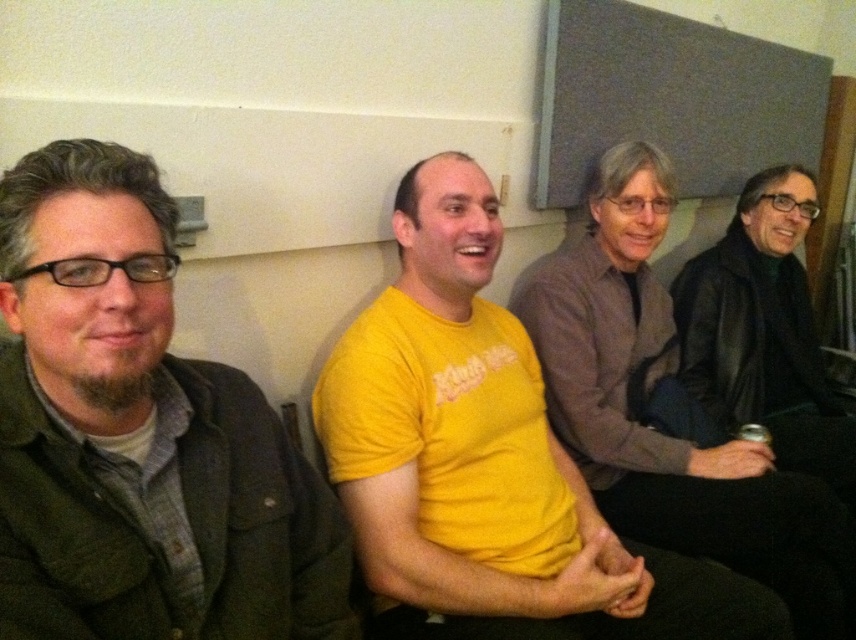
Question: Is yellow t-shirt at center wider than black leather jacket at right?

Choices:
 (A) no
 (B) yes

Answer: (B)

Question: Which point is farther to the camera?

Choices:
 (A) matte black jacket at left
 (B) yellow t-shirt at center

Answer: (B)

Question: Does matte black jacket at left have a lesser width compared to yellow t-shirt at center?

Choices:
 (A) no
 (B) yes

Answer: (B)

Question: Among these points, which one is farthest from the camera?

Choices:
 (A) (629, 465)
 (B) (733, 356)

Answer: (B)

Question: Among these points, which one is farthest from the camera?

Choices:
 (A) (92, 246)
 (B) (738, 314)

Answer: (B)

Question: Does matte black jacket at left lie in front of yellow t-shirt at center?

Choices:
 (A) yes
 (B) no

Answer: (A)